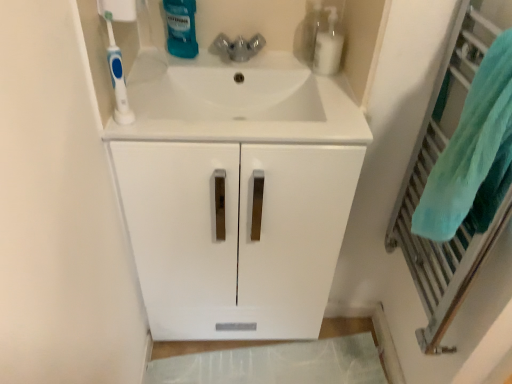
Find the location of a particular element. Image resolution: width=512 pixels, height=384 pixels. empty space that is to the right of translucent plastic mouthwash at upper center, the first cleaning product positioned from the left is located at coordinates (222, 61).